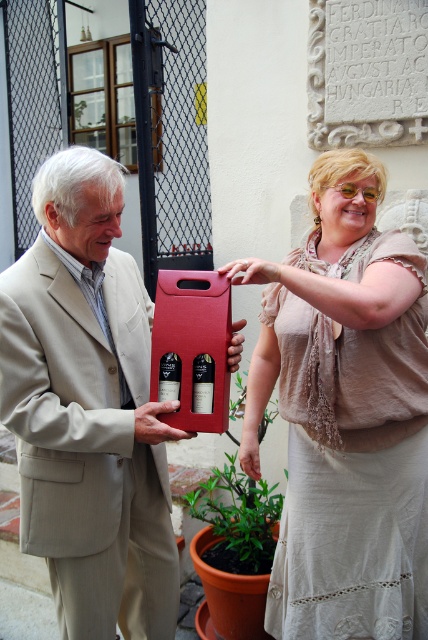
Question: Which of the following is the closest to the observer?

Choices:
 (A) matte black wine at center
 (B) matte red wine at center

Answer: (A)

Question: Is matte beige dress at center thinner than beige fabric suit at left?

Choices:
 (A) yes
 (B) no

Answer: (A)

Question: Which object appears closest to the camera in this image?

Choices:
 (A) matte black wine at center
 (B) matte beige dress at center

Answer: (B)

Question: Does matte beige dress at center have a lesser width compared to matte red wine at center?

Choices:
 (A) yes
 (B) no

Answer: (B)

Question: Which point appears farthest from the camera in this image?

Choices:
 (A) (163, 390)
 (B) (198, 410)
 (C) (276, 410)
 (D) (412, 589)

Answer: (C)

Question: Does matte black wine at center have a larger size compared to matte red wine at center?

Choices:
 (A) no
 (B) yes

Answer: (B)